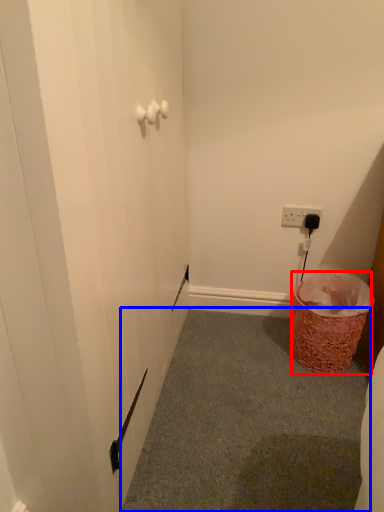
Question: Among these objects, which one is farthest to the camera, basket (highlighted by a red box) or plain (highlighted by a blue box)?

Choices:
 (A) basket
 (B) plain

Answer: (A)